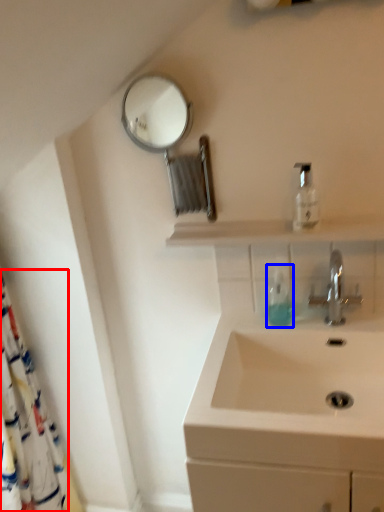
Question: Which object is closer to the camera taking this photo, shower curtain (highlighted by a red box) or soap dispenser (highlighted by a blue box)?

Choices:
 (A) shower curtain
 (B) soap dispenser

Answer: (A)